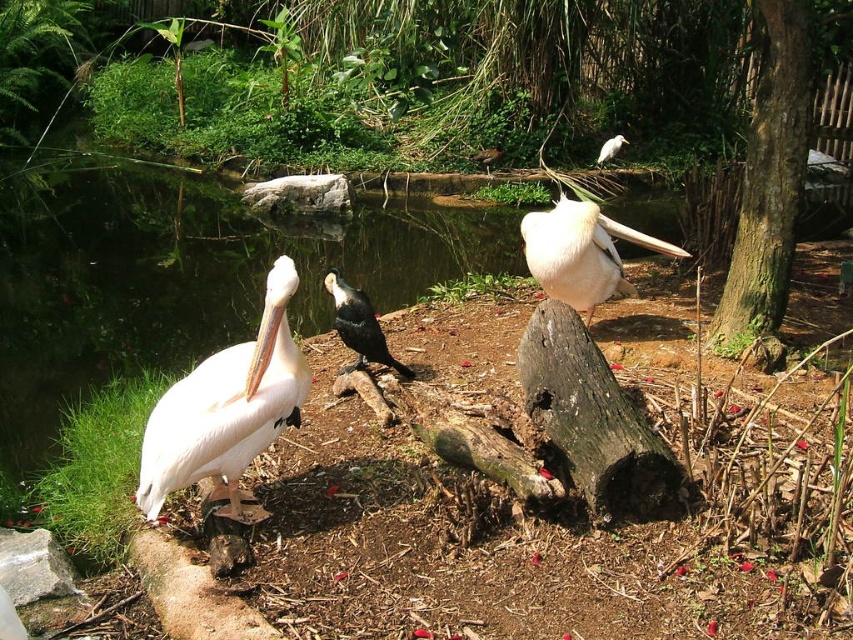
Question: Which point is closer to the camera taking this photo?

Choices:
 (A) (254, 438)
 (B) (614, 138)
 (C) (355, 248)
 (D) (584, 252)

Answer: (A)

Question: Which of the following is the closest to the observer?

Choices:
 (A) (352, 332)
 (B) (618, 147)
 (C) (207, 372)
 (D) (585, 260)

Answer: (C)

Question: Which is nearer to the transparent water at center?

Choices:
 (A) shiny black bird at center
 (B) white matte pelican at left

Answer: (A)

Question: Does transparent water at center have a smaller size compared to white matte pelican at center?

Choices:
 (A) no
 (B) yes

Answer: (B)

Question: Does transparent water at center lie in front of white matte pelican at left?

Choices:
 (A) no
 (B) yes

Answer: (A)

Question: Does transparent water at center appear on the right side of white matte pelican at center?

Choices:
 (A) no
 (B) yes

Answer: (A)